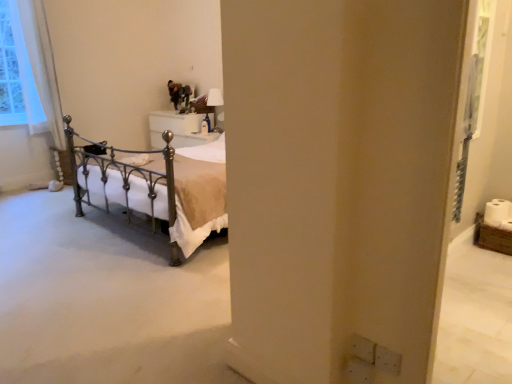
Question: Considering the relative sizes of white glossy nightstand at center and white sheer curtain at left in the image provided, is white glossy nightstand at center smaller than white sheer curtain at left?

Choices:
 (A) yes
 (B) no

Answer: (A)

Question: Is white glossy nightstand at center beside white sheer curtain at left?

Choices:
 (A) yes
 (B) no

Answer: (B)

Question: Does white glossy nightstand at center have a greater height compared to white sheer curtain at left?

Choices:
 (A) yes
 (B) no

Answer: (B)

Question: From the image's perspective, is white glossy nightstand at center above white sheer curtain at left?

Choices:
 (A) yes
 (B) no

Answer: (B)

Question: Is white glossy nightstand at center positioned with its back to white sheer curtain at left?

Choices:
 (A) yes
 (B) no

Answer: (B)

Question: Considering their positions, is white glossy lampshade at upper center located in front of or behind white glossy nightstand at center?

Choices:
 (A) behind
 (B) front

Answer: (B)

Question: Which is correct: white glossy lampshade at upper center is inside white glossy nightstand at center, or outside of it?

Choices:
 (A) inside
 (B) outside

Answer: (B)

Question: From the image's perspective, relative to white glossy nightstand at center, is white glossy lampshade at upper center above or below?

Choices:
 (A) above
 (B) below

Answer: (A)

Question: Would you say white glossy lampshade at upper center is to the left or to the right of white glossy nightstand at center in the picture?

Choices:
 (A) left
 (B) right

Answer: (B)

Question: From a real-world perspective, is white sheer curtain at left physically located above or below white glossy nightstand at center?

Choices:
 (A) below
 (B) above

Answer: (B)

Question: Is white sheer curtain at left taller or shorter than white glossy nightstand at center?

Choices:
 (A) tall
 (B) short

Answer: (A)

Question: Based on their sizes in the image, would you say white sheer curtain at left is bigger or smaller than white glossy nightstand at center?

Choices:
 (A) big
 (B) small

Answer: (A)

Question: In the image, is white sheer curtain at left on the left side or the right side of white glossy nightstand at center?

Choices:
 (A) right
 (B) left

Answer: (B)

Question: From the image's perspective, relative to white sheer curtain at left, is white glossy lampshade at upper center above or below?

Choices:
 (A) above
 (B) below

Answer: (B)

Question: Based on their sizes in the image, would you say white glossy lampshade at upper center is bigger or smaller than white sheer curtain at left?

Choices:
 (A) small
 (B) big

Answer: (A)